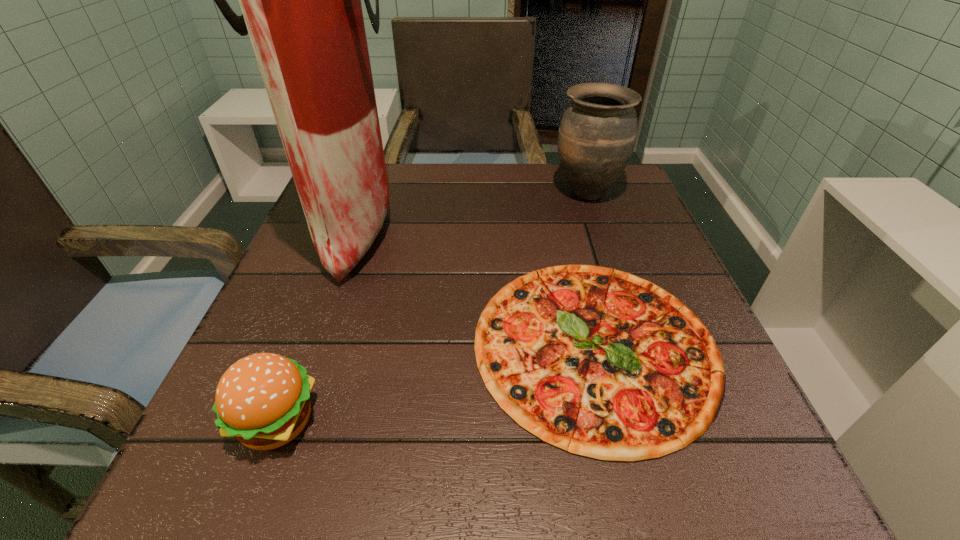
Where is `hamburger that is positioned at the near edge`? The image size is (960, 540). hamburger that is positioned at the near edge is located at coordinates (263, 400).

The image size is (960, 540). I want to click on pizza situated at the near edge, so click(x=599, y=362).

You are a GUI agent. You are given a task and a screenshot of the screen. Output one action in this format:
    pyautogui.click(x=<x>, y=<y>)
    Task: Click on the grocery bag present at the left edge
    The height and width of the screenshot is (540, 960).
    Given the screenshot: What is the action you would take?
    pyautogui.click(x=301, y=0)

Locate an element on the screen. hamburger that is at the left edge is located at coordinates (263, 400).

At what (x,y) coordinates should I click in order to perform the action: click on urn that is at the right edge. Please return your answer as a coordinate pair (x, y). Image resolution: width=960 pixels, height=540 pixels. Looking at the image, I should click on (597, 134).

I want to click on pizza that is positioned at the right edge, so click(x=599, y=362).

Where is `object located in the far left corner section of the desktop`? object located in the far left corner section of the desktop is located at coordinates (301, 0).

Find the location of a particular element. This screenshot has width=960, height=540. object at the near left corner is located at coordinates (263, 400).

Find the location of a particular element. This screenshot has width=960, height=540. object present at the far right corner is located at coordinates (597, 134).

Locate an element on the screen. object present at the near right corner is located at coordinates (599, 362).